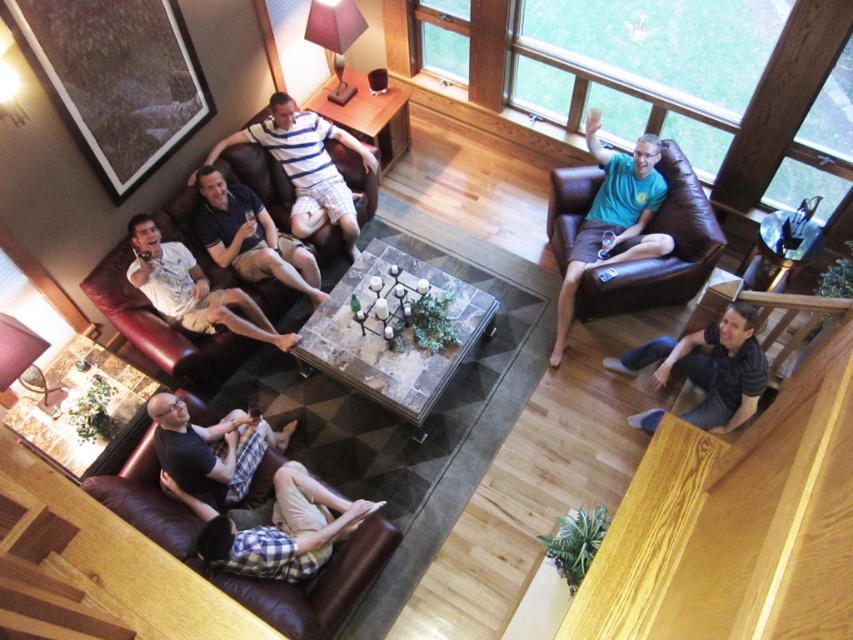
Between brown leather couch at lower left and light beige shorts at lower left, which one is positioned higher?

light beige shorts at lower left is above.

Which is in front, point (109, 492) or point (129, 228)?

Point (109, 492) is in front.

The image size is (853, 640). I want to click on brown leather couch at lower left, so click(x=247, y=577).

Between plaid fabric shirt at lower left and striped cotton shirt at center, which one has less height?

With less height is plaid fabric shirt at lower left.

Describe the element at coordinates (277, 528) in the screenshot. The image size is (853, 640). I see `plaid fabric shirt at lower left` at that location.

Between point (233, 550) and point (292, 125), which one is positioned behind?

The point (292, 125) is more distant.

Find the location of a particular element. This screenshot has width=853, height=640. plaid fabric shirt at lower left is located at coordinates (277, 528).

Can you confirm if dark gray fabric couch at lower left is positioned below striped cotton shirt at center?

Correct, dark gray fabric couch at lower left is located below striped cotton shirt at center.

Which of these two, dark gray fabric couch at lower left or striped cotton shirt at center, stands shorter?

dark gray fabric couch at lower left is shorter.

Where is `dark gray fabric couch at lower left`? Image resolution: width=853 pixels, height=640 pixels. dark gray fabric couch at lower left is located at coordinates (209, 452).